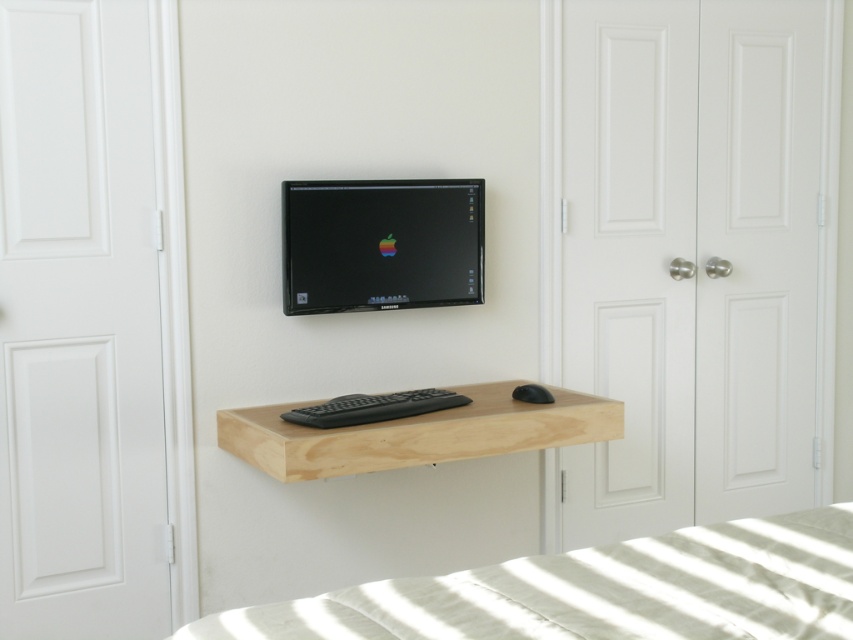
Does point (730, 632) lie in front of point (309, 426)?

Yes, it is in front of point (309, 426).

Does white linen bed at lower center appear on the left side of black matte keyboard at center?

Incorrect, white linen bed at lower center is not on the left side of black matte keyboard at center.

Locate an element on the screen. This screenshot has height=640, width=853. white linen bed at lower center is located at coordinates (598, 592).

This screenshot has height=640, width=853. I want to click on white linen bed at lower center, so click(598, 592).

Does natural wood floating shelf at center appear under black matte keyboard at center?

Yes.

Is natural wood floating shelf at center to the right of black matte keyboard at center from the viewer's perspective?

Correct, you'll find natural wood floating shelf at center to the right of black matte keyboard at center.

Does point (535, 433) come behind point (419, 404)?

Yes.

The image size is (853, 640). I want to click on natural wood floating shelf at center, so click(x=416, y=433).

Who is taller, black matte keyboard at center or black matte mouse at center?

Standing taller between the two is black matte keyboard at center.

You are a GUI agent. You are given a task and a screenshot of the screen. Output one action in this format:
    pyautogui.click(x=<x>, y=<y>)
    Task: Click on the black matte keyboard at center
    
    Given the screenshot: What is the action you would take?
    pyautogui.click(x=373, y=406)

Describe the element at coordinates (373, 406) in the screenshot. I see `black matte keyboard at center` at that location.

The image size is (853, 640). Find the location of `black matte keyboard at center`. black matte keyboard at center is located at coordinates (373, 406).